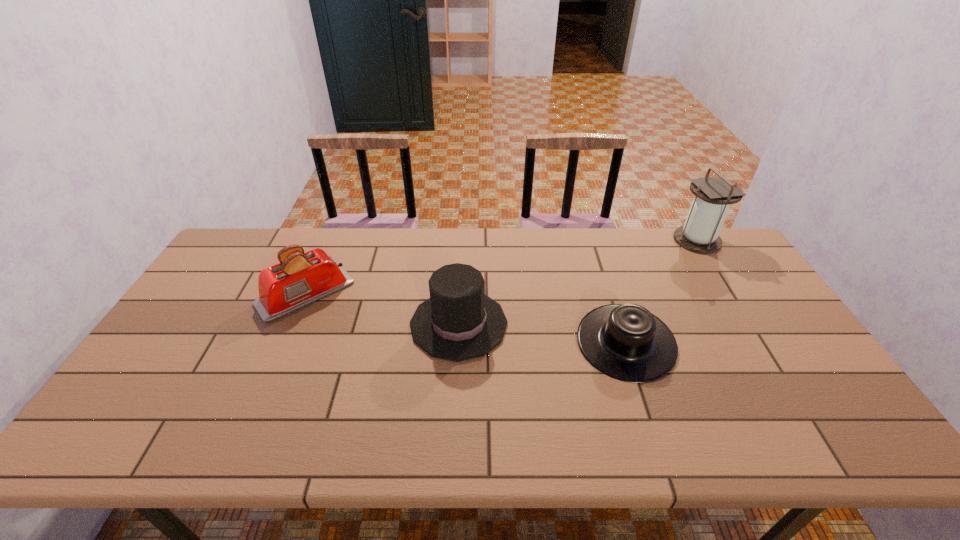
Identify the location of the rightmost object. (700, 234).

The image size is (960, 540). Identify the location of lantern. coord(700,234).

Where is `the third object from right to left`? The width and height of the screenshot is (960, 540). the third object from right to left is located at coordinates (458, 322).

Where is `the left dress hat`? the left dress hat is located at coordinates (458, 322).

This screenshot has width=960, height=540. Find the location of `toaster`. toaster is located at coordinates (300, 279).

I want to click on the shortest object, so click(626, 342).

Where is `the shorter dress hat`? the shorter dress hat is located at coordinates (626, 342).

Locate an element on the screen. This screenshot has height=540, width=960. vacant point located 0.120m on the left of the rightmost object is located at coordinates 641,240.

Identify the location of free space located 0.240m on the front of the left dress hat with the decoration. (591, 324).

At what (x,y) coordinates should I click in order to perform the action: click on free space located 0.220m on the front of the toaster. Please return your answer as a coordinate pair (x, y). The height and width of the screenshot is (540, 960). Looking at the image, I should click on (264, 389).